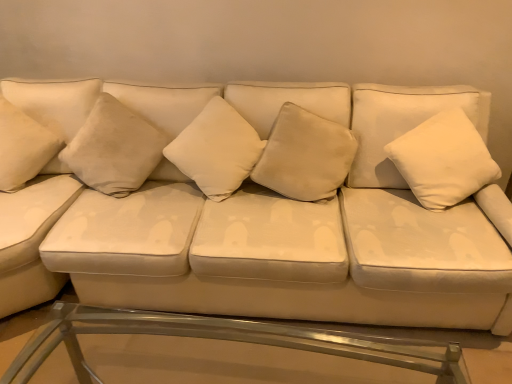
Measure the distance between suede white couch at center and camera.

The distance of suede white couch at center from camera is 1.54 meters.

I want to click on clear glass table at lower center, so click(224, 339).

In the scene shown: What is the approximate width of suede-like beige pillow at center, the second pillow from the right?

suede-like beige pillow at center, the second pillow from the right, is 6.61 inches wide.

This screenshot has width=512, height=384. Describe the element at coordinates (216, 150) in the screenshot. I see `white soft cushion at center, which is the third pillow from left to right` at that location.

Identify the location of suede white couch at center. (273, 206).

Is suede white couch at center bigger or smaller than suede-like beige pillow at center, the second pillow from the right?

Clearly, suede white couch at center is larger in size than suede-like beige pillow at center, the second pillow from the right.

Does point (354, 247) appear closer or farther from the camera than point (285, 187)?

Point (354, 247) is positioned closer to the camera compared to point (285, 187).

Between suede white couch at center and suede-like beige pillow at center, the second pillow from the right, which one has more height?

With more height is suede white couch at center.

Which is more to the right, suede white couch at center or suede-like beige pillow at center, the second pillow from the right?

From the viewer's perspective, suede-like beige pillow at center, the second pillow from the right, appears more on the right side.

In the image, is white velvety pillow at right, which appears as the 5th pillow when viewed from the left, on the left side or the right side of suede-like beige pillow at center, which appears as the 2th pillow when viewed from the left?

white velvety pillow at right, which appears as the 5th pillow when viewed from the left, is to the right of suede-like beige pillow at center, which appears as the 2th pillow when viewed from the left.

Based on their sizes in the image, would you say white velvety pillow at right, the first pillow in the right-to-left sequence, is bigger or smaller than suede-like beige pillow at center, the fourth pillow from the right?

white velvety pillow at right, the first pillow in the right-to-left sequence, is bigger than suede-like beige pillow at center, the fourth pillow from the right.

Can you tell me how much white velvety pillow at right, which appears as the 5th pillow when viewed from the left, and suede-like beige pillow at center, the fourth pillow from the right, differ in facing direction?

The angle between the facing direction of white velvety pillow at right, which appears as the 5th pillow when viewed from the left, and the facing direction of suede-like beige pillow at center, the fourth pillow from the right, is 6.36 degrees.

Based on the photo, which point is more distant from viewer, [429,152] or [99,174]?

The point [99,174] is more distant.

Looking at this image, from the image's perspective, is white velvety pillow at right, which appears as the 5th pillow when viewed from the left, located beneath white soft cushion at center, which is the third pillow from left to right?

Yes.

Is white velvety pillow at right, which appears as the 5th pillow when viewed from the left, beside white soft cushion at center, the third pillow viewed from the right?

There is a gap between white velvety pillow at right, which appears as the 5th pillow when viewed from the left, and white soft cushion at center, the third pillow viewed from the right.

Between white velvety pillow at right, which appears as the 5th pillow when viewed from the left, and white soft cushion at center, which is the third pillow from left to right, which one has less height?

white soft cushion at center, which is the third pillow from left to right, is shorter.

Which is more to the right, white velvety pillow at right, which appears as the 5th pillow when viewed from the left, or white soft cushion at center, which is the third pillow from left to right?

white velvety pillow at right, which appears as the 5th pillow when viewed from the left, is more to the right.

Between suede-like beige pillow at center, the second pillow from the right, and white soft cushion at center, the third pillow viewed from the right, which one appears on the right side from the viewer's perspective?

Positioned to the right is suede-like beige pillow at center, the second pillow from the right.

From a real-world perspective, is suede-like beige pillow at center, the second pillow from the right, physically above white soft cushion at center, the third pillow viewed from the right?

Actually, suede-like beige pillow at center, the second pillow from the right, is physically below white soft cushion at center, the third pillow viewed from the right, in the real world.

From the image's perspective, between suede-like beige pillow at center, the second pillow from the right, and white soft cushion at center, the third pillow viewed from the right, who is located below?

suede-like beige pillow at center, the second pillow from the right.

Can you confirm if suede white couch at center is thinner than suede-like beige pillow at center, which appears as the 2th pillow when viewed from the left?

Incorrect, the width of suede white couch at center is not less than that of suede-like beige pillow at center, which appears as the 2th pillow when viewed from the left.

From the picture: Would you say suede white couch at center is inside or outside suede-like beige pillow at center, the fourth pillow from the right?

suede white couch at center is not enclosed by suede-like beige pillow at center, the fourth pillow from the right.

Is suede-like beige pillow at center, the fourth pillow from the right, at the back of suede white couch at center?

suede white couch at center is not turned away from suede-like beige pillow at center, the fourth pillow from the right.

Is point (383, 286) more distant than point (111, 173)?

No, (383, 286) is in front of (111, 173).

Is clear glass table at lower center aimed at white soft cushion at center, which is the third pillow from left to right?

No, clear glass table at lower center is not oriented towards white soft cushion at center, which is the third pillow from left to right.

Looking at their sizes, would you say clear glass table at lower center is wider or thinner than white soft cushion at center, the third pillow viewed from the right?

In the image, clear glass table at lower center appears to be more narrow than white soft cushion at center, the third pillow viewed from the right.

From a real-world perspective, is clear glass table at lower center positioned above or below white soft cushion at center, which is the third pillow from left to right?

clear glass table at lower center is below white soft cushion at center, which is the third pillow from left to right.

Based on the photo, considering the relative sizes of suede-like beige pillow at center, which appears as the 2th pillow when viewed from the left, and white velvety pillow at left, marked as the first pillow in a left-to-right arrangement, in the image provided, is suede-like beige pillow at center, which appears as the 2th pillow when viewed from the left, shorter than white velvety pillow at left, marked as the first pillow in a left-to-right arrangement,?

Correct, suede-like beige pillow at center, which appears as the 2th pillow when viewed from the left, is not as tall as white velvety pillow at left, marked as the first pillow in a left-to-right arrangement.

Which is behind, suede-like beige pillow at center, which appears as the 2th pillow when viewed from the left, or white velvety pillow at left, the fifth pillow positioned from the right?

suede-like beige pillow at center, which appears as the 2th pillow when viewed from the left, is further away from the camera.

Considering the points (124, 191) and (28, 143), which point is in front, point (124, 191) or point (28, 143)?

Positioned in front is point (28, 143).

From the image's perspective, between suede-like beige pillow at center, the fourth pillow from the right, and white velvety pillow at left, the fifth pillow positioned from the right, who is located below?

suede-like beige pillow at center, the fourth pillow from the right.

This screenshot has width=512, height=384. What are the coordinates of `studio couch below the suede-like beige pillow at center, the 4th pillow positioned from the left (from the image's perspective)` in the screenshot? It's located at (273, 206).

Which pillow is the 3rd one when counting from the right side of the suede-like beige pillow at center, the fourth pillow from the right? Please provide its 2D coordinates.

[(443, 160)]

Looking at the image, which one is located closer to suede-like beige pillow at center, the second pillow from the right, suede white couch at center or white velvety pillow at right, the first pillow in the right-to-left sequence?

Based on the image, suede white couch at center appears to be nearer to suede-like beige pillow at center, the second pillow from the right.

Which object lies nearer to the anchor point white velvety pillow at left, marked as the first pillow in a left-to-right arrangement, suede-like beige pillow at center, which appears as the 2th pillow when viewed from the left, or suede white couch at center?

The object closer to white velvety pillow at left, marked as the first pillow in a left-to-right arrangement, is suede-like beige pillow at center, which appears as the 2th pillow when viewed from the left.

Based on their spatial positions, is clear glass table at lower center or suede-like beige pillow at center, the fourth pillow from the right, further from suede white couch at center?

clear glass table at lower center lies further to suede white couch at center than the other object.

Which object lies further to the anchor point suede white couch at center, white velvety pillow at right, the first pillow in the right-to-left sequence, or clear glass table at lower center?

clear glass table at lower center is further to suede white couch at center.

From the image, which object appears to be farther from white velvety pillow at right, which appears as the 5th pillow when viewed from the left, suede-like beige pillow at center, the 4th pillow positioned from the left, or suede white couch at center?

Among the two, suede white couch at center is located further to white velvety pillow at right, which appears as the 5th pillow when viewed from the left.

Looking at the image, which one is located further to suede white couch at center, white velvety pillow at right, which appears as the 5th pillow when viewed from the left, or suede-like beige pillow at center, the fourth pillow from the right?

white velvety pillow at right, which appears as the 5th pillow when viewed from the left.

Considering their positions, is white velvety pillow at left, marked as the first pillow in a left-to-right arrangement, positioned closer to white velvety pillow at right, the first pillow in the right-to-left sequence, than suede-like beige pillow at center, the second pillow from the right?

suede-like beige pillow at center, the second pillow from the right, is closer to white velvety pillow at right, the first pillow in the right-to-left sequence.

When comparing their distances from suede white couch at center, does clear glass table at lower center or suede-like beige pillow at center, the second pillow from the right, seem further?

clear glass table at lower center is positioned further to the anchor suede white couch at center.

Locate an element on the screen. This screenshot has width=512, height=384. studio couch between suede-like beige pillow at center, the 4th pillow positioned from the left, and clear glass table at lower center, in the vertical direction is located at coordinates (273, 206).

The height and width of the screenshot is (384, 512). I want to click on studio couch located between suede-like beige pillow at center, which appears as the 2th pillow when viewed from the left, and white velvety pillow at right, the first pillow in the right-to-left sequence, in the left-right direction, so click(273, 206).

The height and width of the screenshot is (384, 512). What are the coordinates of `pillow between suede-like beige pillow at center, which appears as the 2th pillow when viewed from the left, and suede-like beige pillow at center, the second pillow from the right` in the screenshot? It's located at (216, 150).

In order to click on studio couch between white velvety pillow at left, marked as the first pillow in a left-to-right arrangement, and suede-like beige pillow at center, the second pillow from the right in this screenshot , I will do `click(273, 206)`.